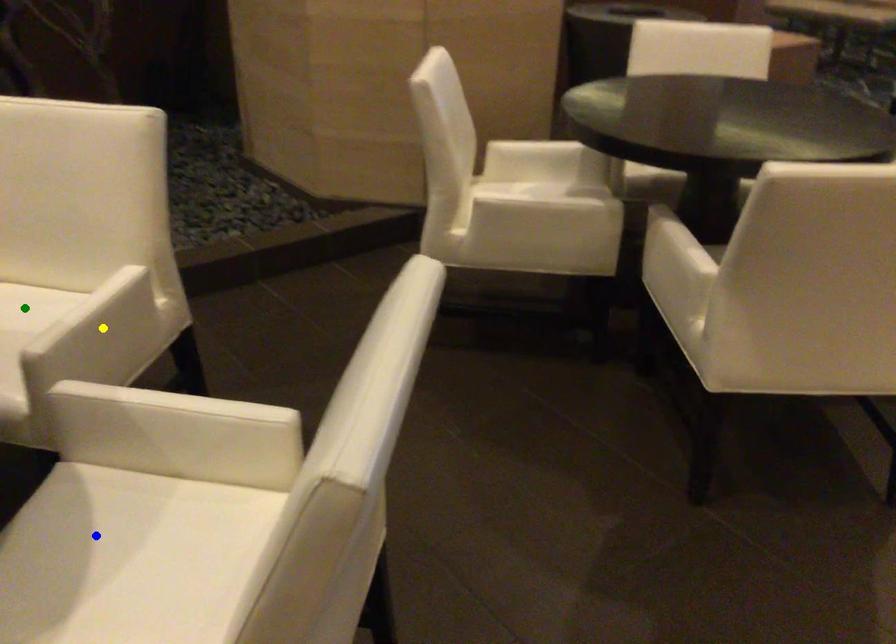
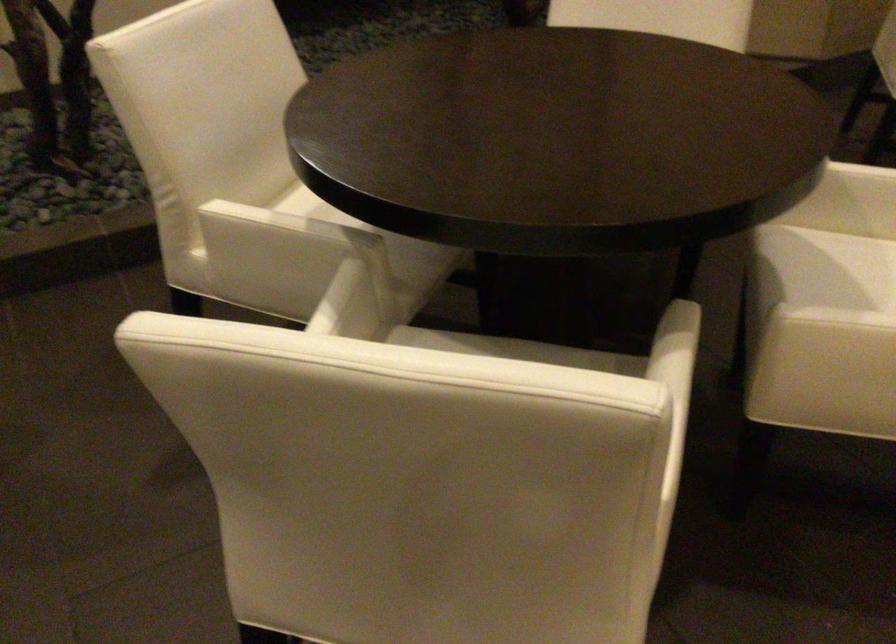
I am providing you with two images of the same scene from different viewpoints. Three points are marked in image1. Which point corresponds to a part or object that is occluded in image2?In image1, three points are marked. Which of them correspond to a part or object that is occluded in image2?Among the three points shown in image1, which one corresponds to a part or object that is no longer visible due to occlusion in image2?

green point, yellow point